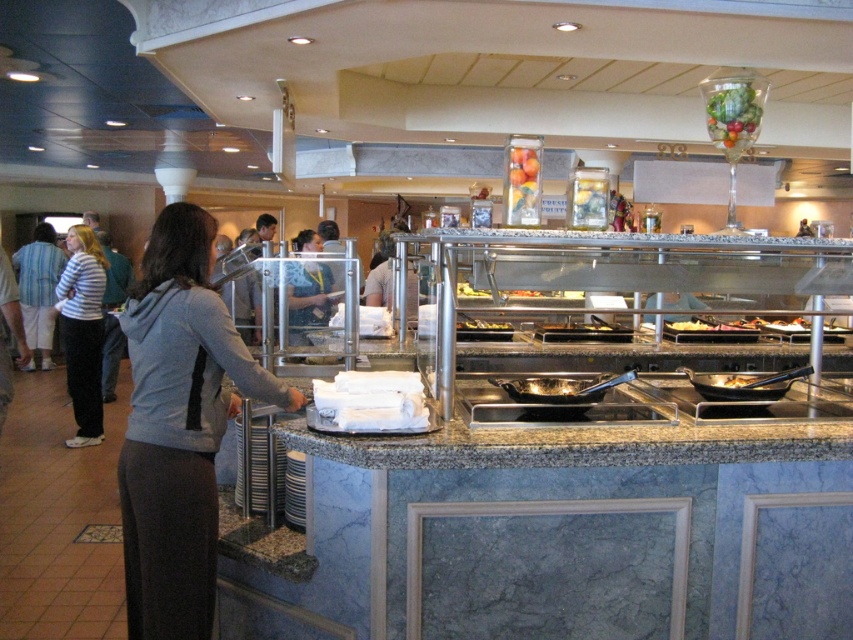
Is the position of striped cotton shirt at left more distant than that of slightly browned bread at center?

That is True.

Is striped cotton shirt at left thinner than slightly browned bread at center?

No, striped cotton shirt at left is not thinner than slightly browned bread at center.

Does point (80, 257) lie behind point (469, 326)?

Yes, point (80, 257) is farther from viewer.

At what (x,y) coordinates should I click in order to perform the action: click on striped cotton shirt at left. Please return your answer as a coordinate pair (x, y). This screenshot has width=853, height=640. Looking at the image, I should click on (83, 332).

Can you confirm if striped cotton shirt at left is taller than shiny glass vase at upper center?

Yes.

Which is in front, point (77, 250) or point (537, 164)?

Positioned in front is point (537, 164).

Find the location of a particular element. This screenshot has width=853, height=640. striped cotton shirt at left is located at coordinates (83, 332).

The height and width of the screenshot is (640, 853). Describe the element at coordinates (83, 332) in the screenshot. I see `striped cotton shirt at left` at that location.

Which of these two, striped cotton shirt at left or shiny glass bowl at upper center, stands shorter?

Standing shorter between the two is shiny glass bowl at upper center.

Where is `striped cotton shirt at left`? This screenshot has height=640, width=853. striped cotton shirt at left is located at coordinates (83, 332).